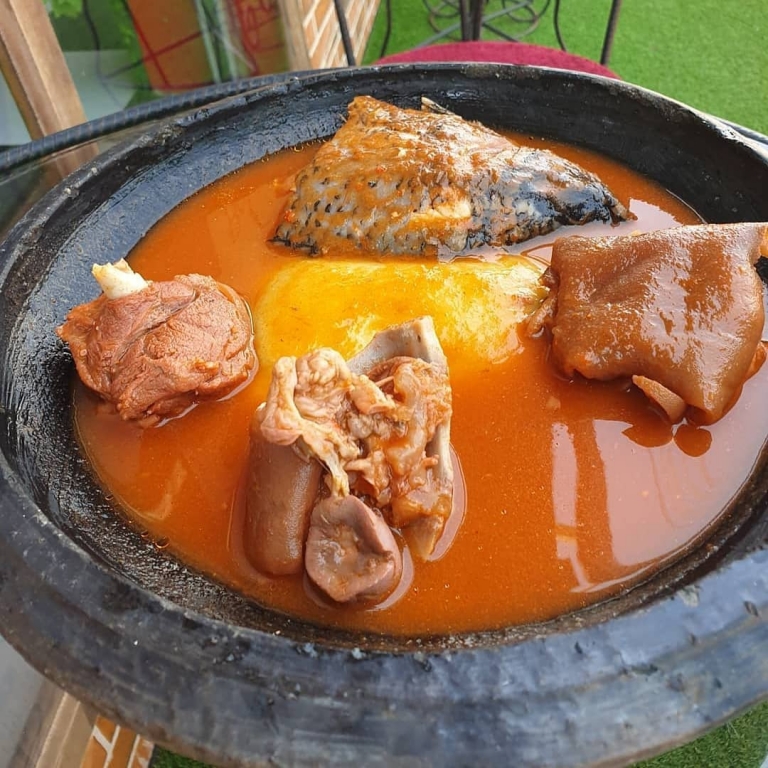
The image size is (768, 768). In order to click on chair cushion in this screenshot , I will do `click(525, 57)`.